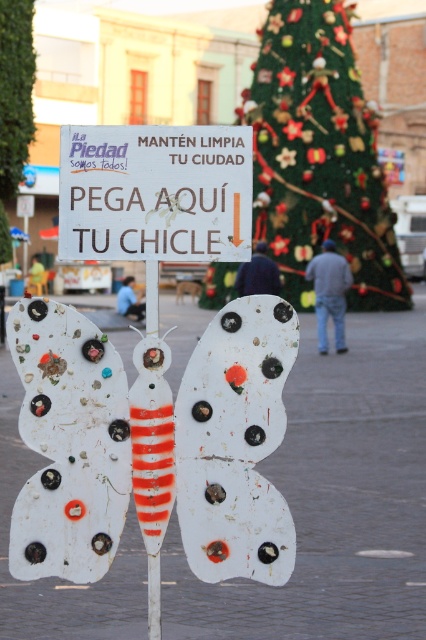
You are a city planner inspecting the plaza. You need to determine if the white plastic butterfly at center can be seen above the white matte sign at center from the main entrance. Based on their sizes, what is your conclusion?

The white plastic butterfly at center is taller than the white matte sign at center, so it can be seen above the white matte sign at center from the main entrance.

What object is located at the coordinates point (236, 444) in the scene?

The point (236, 444) indicates the white matte butterfly at center.